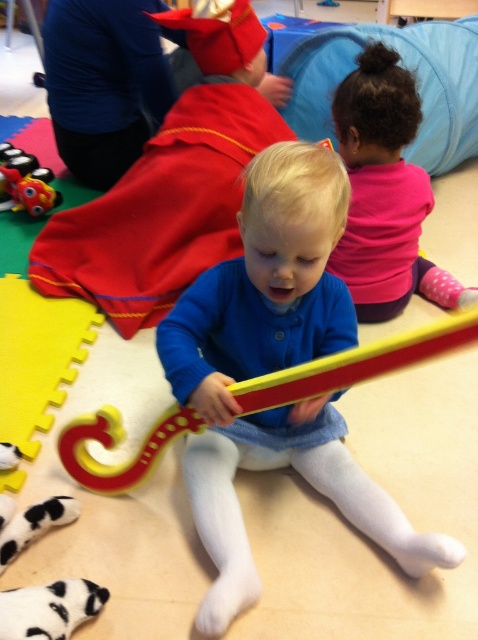
Question: Which object appears farthest from the camera in this image?

Choices:
 (A) pink soft fabric toddler at upper right
 (B) blue soft sweater at center
 (C) matte plastic train at left

Answer: (C)

Question: Does blue soft sweater at center appear under pink soft fabric toddler at upper right?

Choices:
 (A) no
 (B) yes

Answer: (B)

Question: Does blue soft sweater at center appear under matte plastic train at left?

Choices:
 (A) no
 (B) yes

Answer: (B)

Question: Which point is closer to the camera taking this photo?

Choices:
 (A) (2, 192)
 (B) (217, 497)

Answer: (B)

Question: Which point appears closest to the camera in this image?

Choices:
 (A) (227, 304)
 (B) (382, 176)
 (C) (15, 173)

Answer: (A)

Question: Does blue soft sweater at center appear on the left side of matte plastic train at left?

Choices:
 (A) no
 (B) yes

Answer: (A)